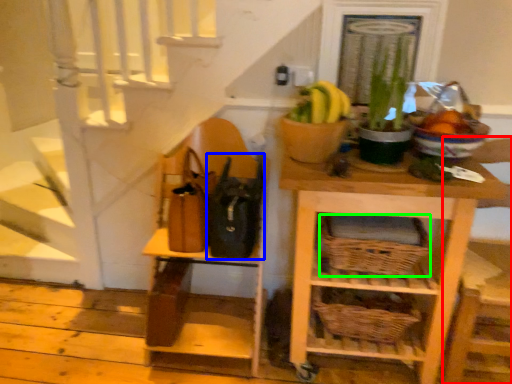
Question: Estimate the real-world distances between objects in this image. Which object is farther from chair (highlighted by a red box), bag (highlighted by a blue box) or basket (highlighted by a green box)?

Choices:
 (A) bag
 (B) basket

Answer: (A)